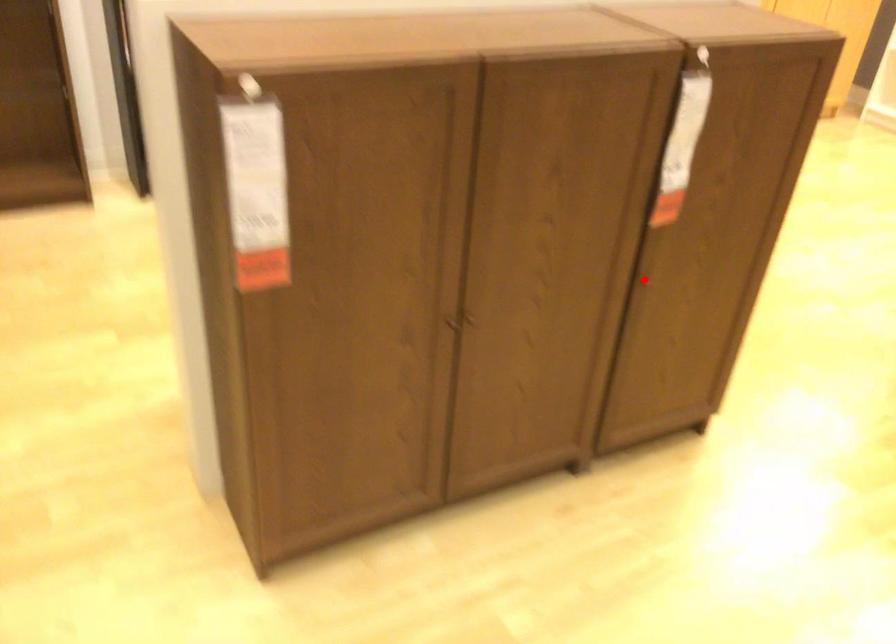
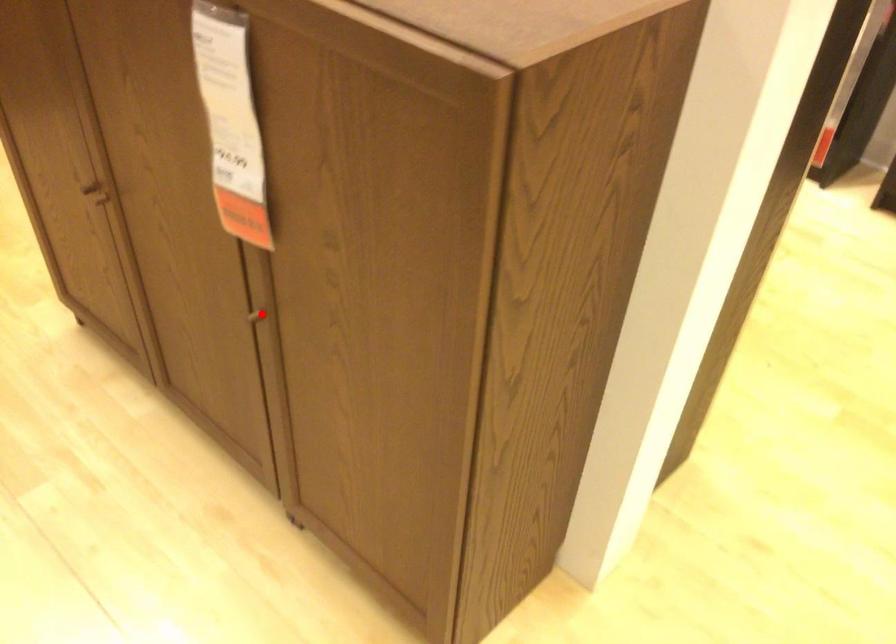
I am providing you with two images of the same scene from different viewpoints. A red point is marked on the first image and another point is marked on the second image. Does the point marked in image1 correspond to the same location as the one in image2?

Yes